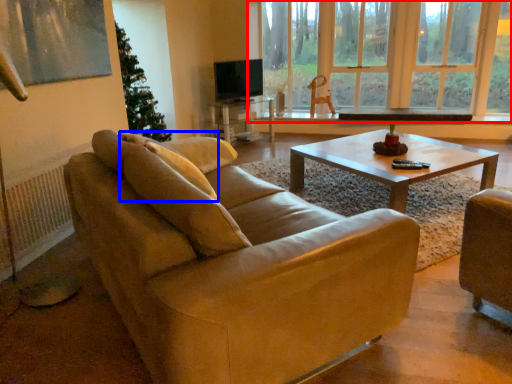
Question: Which point is further to the camera, window (highlighted by a red box) or pillow (highlighted by a blue box)?

Choices:
 (A) window
 (B) pillow

Answer: (A)